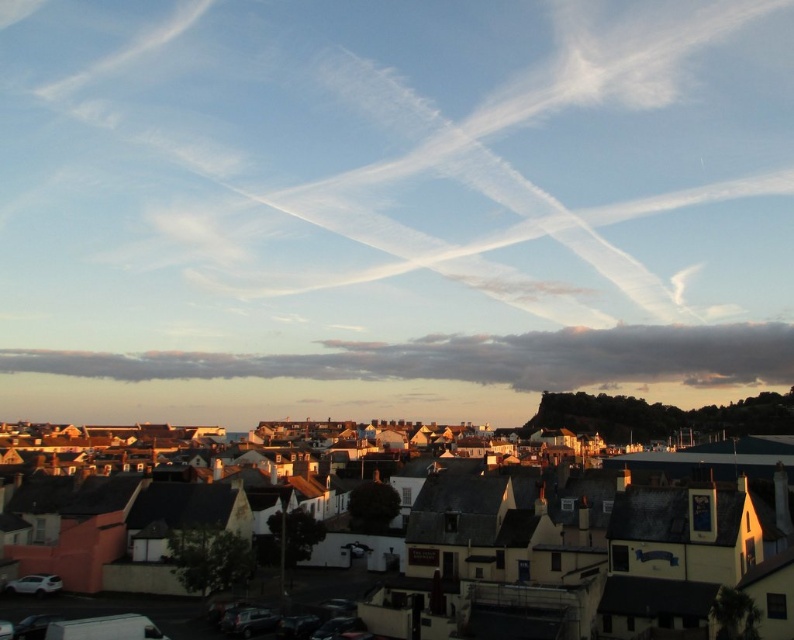
You are standing in the middle of the street looking up at the sky. You see the white wispy clouds at upper center and the cloudy sky at lower center. Which one is closer to the top of the sky?

The white wispy clouds at upper center is closer to the top of the sky because it is positioned over the cloudy sky at lower center.

You are an architect designing a new building and want to ensure it aligns with the existing structures in the scene. Based on the image, which object has a narrower width between the matte yellow building at center and the cloudy sky at lower center?

The matte yellow building at center has a lesser width compared to the cloudy sky at lower center, so the matte yellow building at center is narrower in width.

You are a drone operator planning to fly a drone between the white wispy clouds at upper center and the cloudy sky at lower center. The drone has a maximum flight range of 100 meters. Can the drone safely travel between these two points without running out of battery?

The white wispy clouds at upper center and cloudy sky at lower center are 107.65 meters apart from each other. Since the drone has a maximum flight range of 100 meters, it cannot safely travel between these two points without running out of battery.